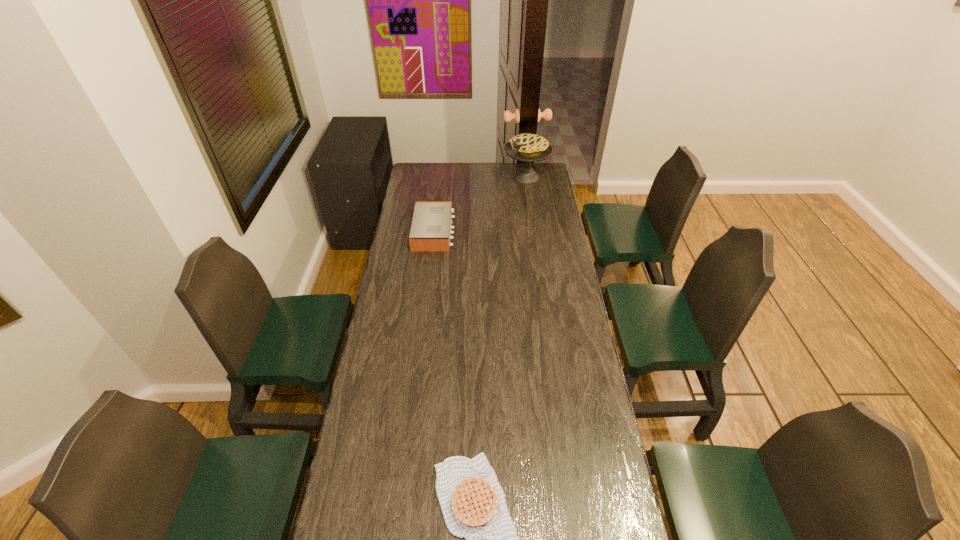
In order to click on the tallest object in this screenshot , I will do `click(526, 147)`.

Image resolution: width=960 pixels, height=540 pixels. Identify the location of the farthest object. (526, 147).

At what (x,y) coordinates should I click in order to perform the action: click on radio receiver. Please return your answer as a coordinate pair (x, y). Looking at the image, I should click on (431, 227).

Where is `the second nearest object`? the second nearest object is located at coordinates (431, 227).

Find the location of a particular element. The height and width of the screenshot is (540, 960). vacant position located 0.190m on the cut side of the farther pie is located at coordinates (470, 178).

Where is `free spot located 0.380m on the cut side of the farther pie`? The width and height of the screenshot is (960, 540). free spot located 0.380m on the cut side of the farther pie is located at coordinates (438, 178).

I want to click on vacant area located on the cut side of the farther pie, so click(x=443, y=178).

Image resolution: width=960 pixels, height=540 pixels. Find the location of `vacant space located on the control panel of the radio receiver`. vacant space located on the control panel of the radio receiver is located at coordinates (472, 232).

This screenshot has width=960, height=540. I want to click on object that is positioned at the far edge, so 526,147.

Image resolution: width=960 pixels, height=540 pixels. Find the location of `object at the left edge`. object at the left edge is located at coordinates point(431,227).